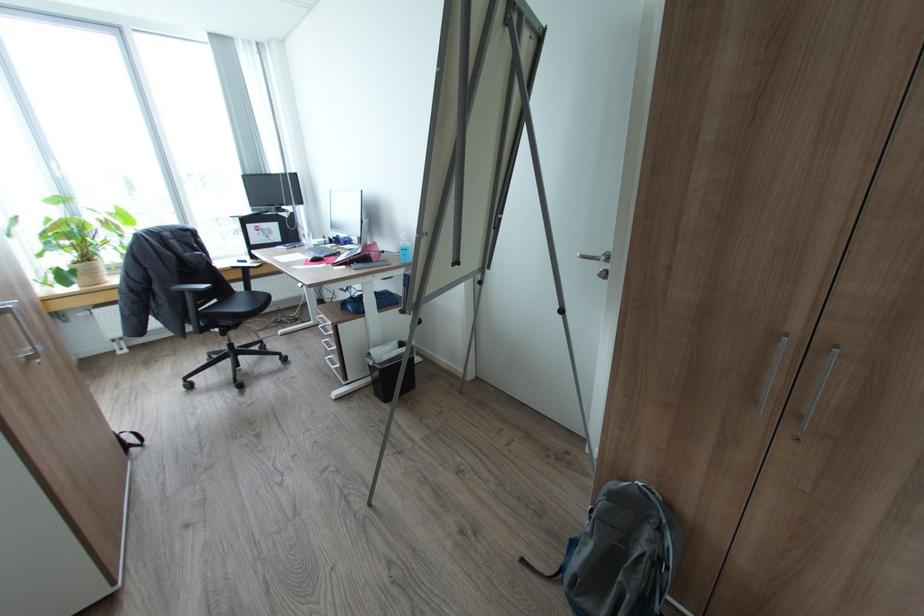
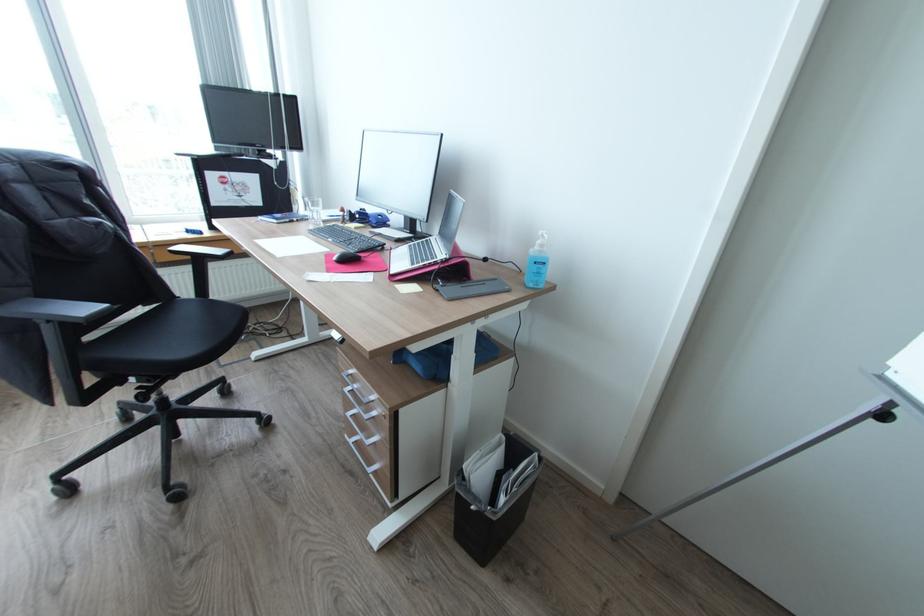
In the second image, find the point that corresponds to (195,292) in the first image.

(55, 321)